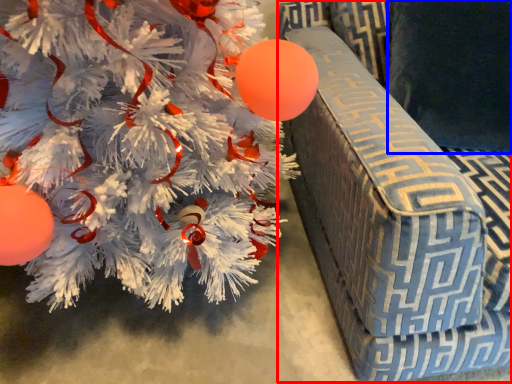
Question: Among these objects, which one is farthest to the camera, armchair (highlighted by a red box) or pillow (highlighted by a blue box)?

Choices:
 (A) armchair
 (B) pillow

Answer: (B)